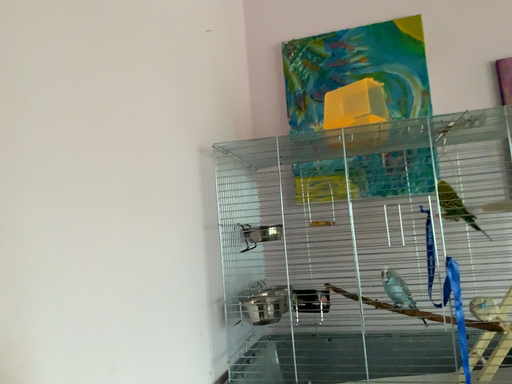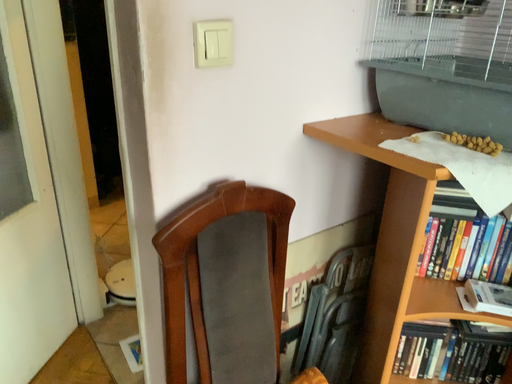
Question: How did the camera likely rotate when shooting the video?

Choices:
 (A) rotated upward
 (B) rotated downward

Answer: (B)